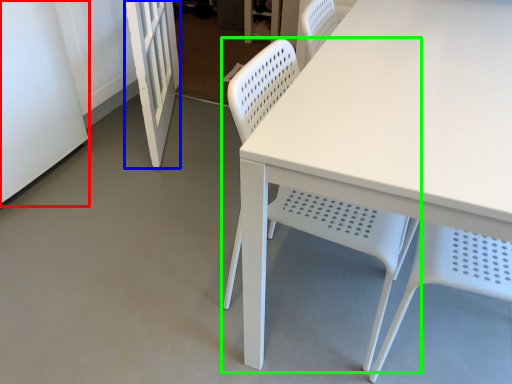
Question: Considering the real-world distances, which object is farthest from screen door (highlighted by a red box)? screen door (highlighted by a blue box) or chair (highlighted by a green box)?

Choices:
 (A) screen door
 (B) chair

Answer: (B)